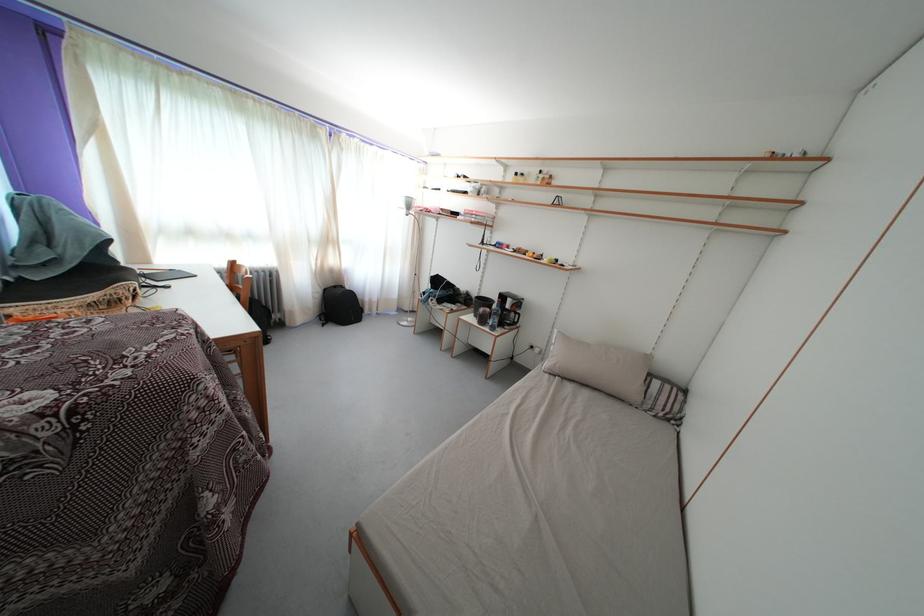
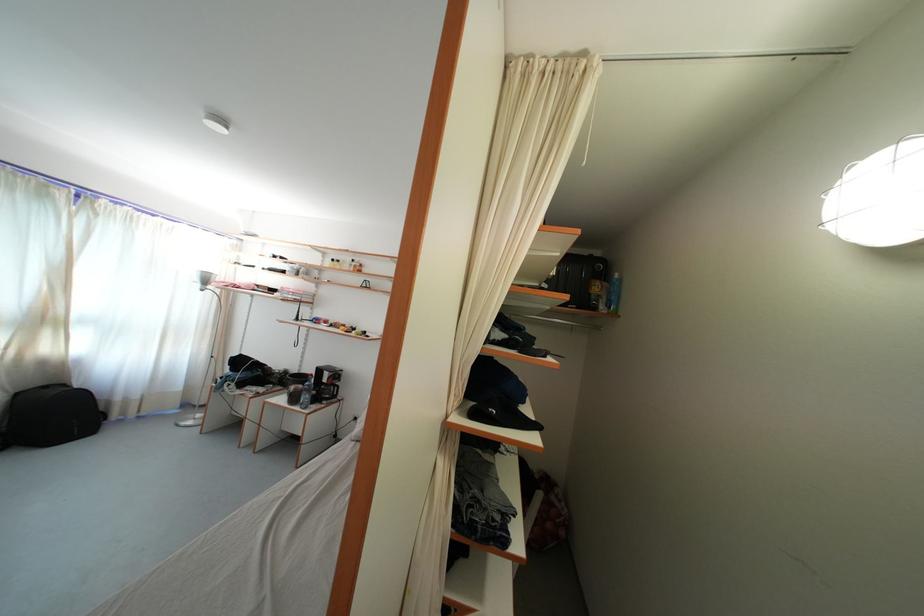
Question: I am providing you with two images of the same scene from different viewpoints. Please identify which objects are invisible in image2.

Choices:
 (A) large black bag
 (B) white window curtain
 (C) blue spray bottle
 (D) none of these

Answer: (D)